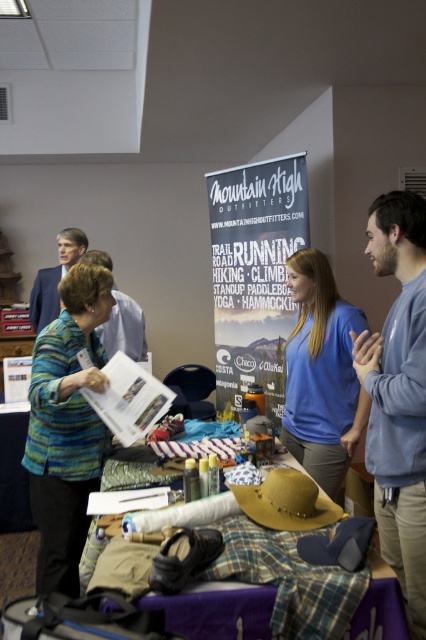
You are organizing an outdoor event booth and need to place a sign on the table. The sign must be placed on top of the plaid fabric at center. Is the white paper at center currently in the way of placing the sign there?

The white paper at center is located above the plaid fabric at center, so it is blocking the area where the sign needs to be placed. Remove or move the white paper at center to access the plaid fabric at center.

Consider the image. You are organizing a booth for an outdoor adventure event. You have two shirts on the table, the blue cotton shirt at center and the matte gray shirt at center. Which shirt should you place on the higher shelf to save space?

The blue cotton shirt at center is taller than the matte gray shirt at center, so placing the blue cotton shirt at center on the higher shelf would save space by utilizing vertical storage effectively.

You are organizing an outdoor event booth and need to place a white paper at center and a plaid fabric at center on a table. According to the scene description, which object is located to the right of the other?

The white paper at center is positioned on the right side of plaid fabric at center.